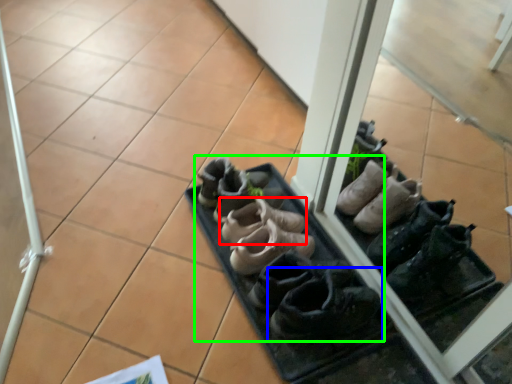
Question: Which is nearer to the footwear (highlighted by a red box)? footwear (highlighted by a blue box) or footwear (highlighted by a green box).

Choices:
 (A) footwear
 (B) footwear

Answer: (B)